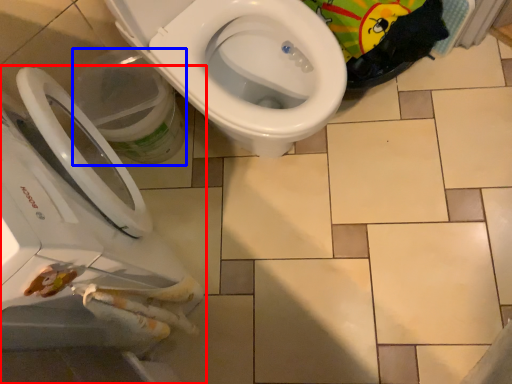
Question: Which object appears closest to the camera in this image, toilet (highlighted by a red box) or potty (highlighted by a blue box)?

Choices:
 (A) toilet
 (B) potty

Answer: (A)